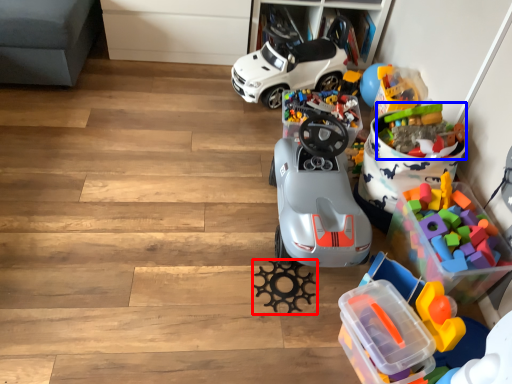
Question: Which object appears farthest to the camera in this image, toy (highlighted by a red box) or toy (highlighted by a blue box)?

Choices:
 (A) toy
 (B) toy

Answer: (B)